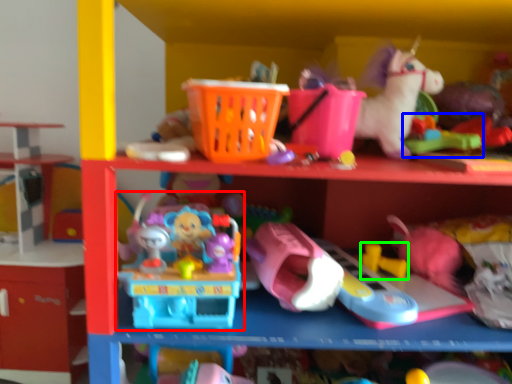
Question: Which object is positioned farthest from toy (highlighted by a red box)? Select from toy (highlighted by a blue box) and toy (highlighted by a green box).

Choices:
 (A) toy
 (B) toy

Answer: (A)